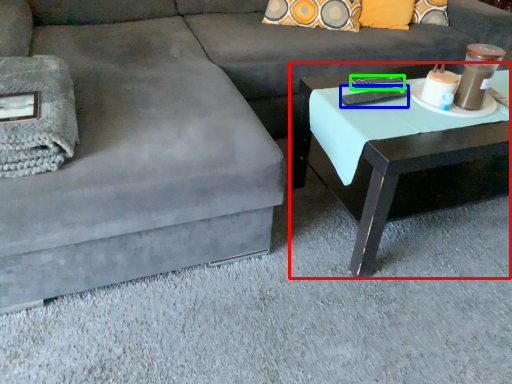
Question: Based on their relative distances, which object is farther from coffee table (highlighted by a red box)? Choose from remote (highlighted by a blue box) and remote (highlighted by a green box).

Choices:
 (A) remote
 (B) remote

Answer: (B)